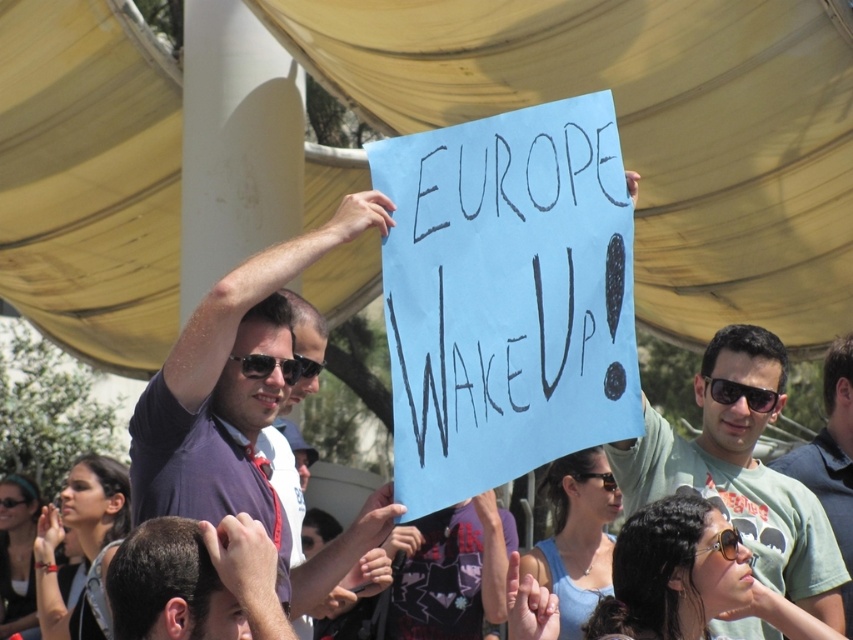
You are a photographer at the protest scene. You want to take a photo of the matte purple shirt at center and the sunglasses at center. Which object should you focus on first if you want to capture both in the same frame without moving the camera?

The matte purple shirt at center is to the left of sunglasses at center. Since they are both at the center, you can focus on either one first as they are positioned closely together, ensuring both are in the same frame.

In the protest scene under the yellow canopy, there are sunglasses at center and black plastic goggles at upper center. Which object is positioned higher in the image?

The black plastic goggles at upper center is positioned higher than the sunglasses at center.